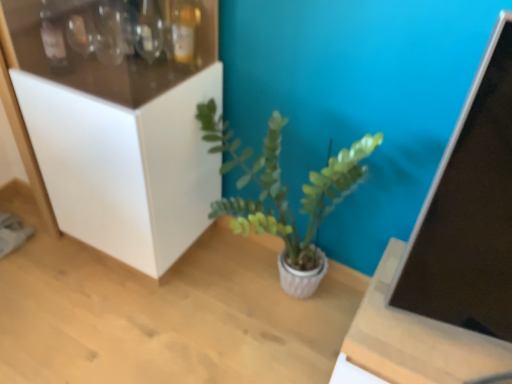
Question: Is white matte cabinet at left bigger or smaller than wooden table at center?

Choices:
 (A) small
 (B) big

Answer: (B)

Question: In terms of width, does white matte cabinet at left look wider or thinner when compared to wooden table at center?

Choices:
 (A) wide
 (B) thin

Answer: (B)

Question: Considering the real-world distances, which object is closest to the wooden table at center?

Choices:
 (A) white matte cabinet at left
 (B) green matte plant at center

Answer: (B)

Question: Estimate the real-world distances between objects in this image. Which object is farther from the white matte cabinet at left?

Choices:
 (A) wooden table at center
 (B) green matte plant at center

Answer: (A)